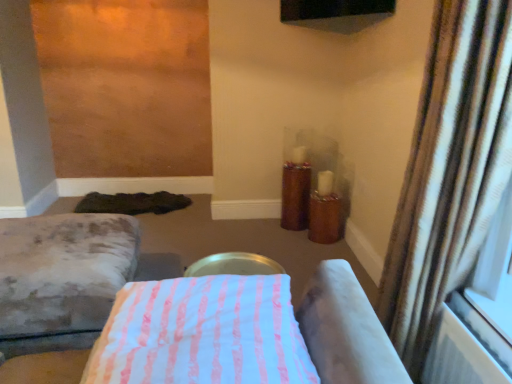
Question: Is point (290, 221) closer or farther from the camera than point (502, 87)?

Choices:
 (A) closer
 (B) farther

Answer: (B)

Question: Is wooden candle holder at center-right taller or shorter than brown striped curtain at right?

Choices:
 (A) tall
 (B) short

Answer: (B)

Question: Estimate the real-world distances between objects in this image. Which object is farther from the brown striped curtain at right?

Choices:
 (A) velvet gray ottoman at lower left, acting as the first furniture starting from the back
 (B) wooden candle holder at center-right
 (C) pink striped fabric at center, the second furniture when ordered from left to right

Answer: (B)

Question: Considering the real-world distances, which object is closest to the brown striped curtain at right?

Choices:
 (A) wooden candle holder at center-right
 (B) pink striped fabric at center, which is the first furniture from right to left
 (C) velvet gray ottoman at lower left, marked as the second furniture in a front-to-back arrangement

Answer: (B)